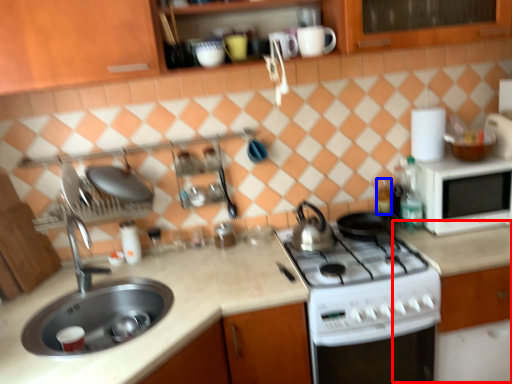
Question: Which object is closer to the camera taking this photo, counter (highlighted by a red box) or bottle (highlighted by a blue box)?

Choices:
 (A) counter
 (B) bottle

Answer: (A)